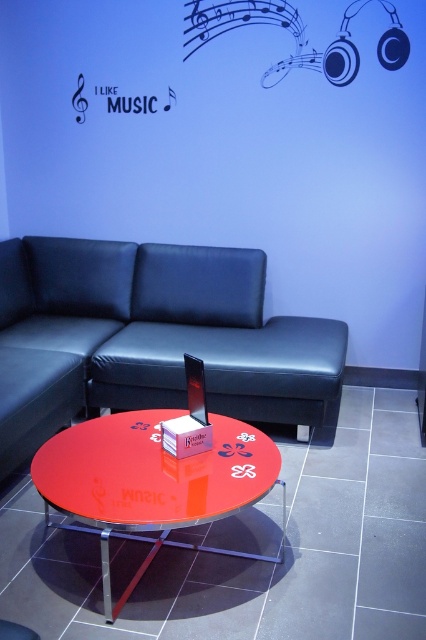
Question: Which point is farther to the camera?

Choices:
 (A) (104, 483)
 (B) (227, 269)

Answer: (B)

Question: Which of the following is the farthest from the observer?

Choices:
 (A) (143, 490)
 (B) (198, 294)

Answer: (B)

Question: Is black leather couch at center wider than glossy red table at center?

Choices:
 (A) yes
 (B) no

Answer: (A)

Question: Does black leather couch at center have a larger size compared to glossy red table at center?

Choices:
 (A) no
 (B) yes

Answer: (B)

Question: Observing the image, what is the correct spatial positioning of black leather couch at center in reference to glossy red table at center?

Choices:
 (A) left
 (B) right

Answer: (A)